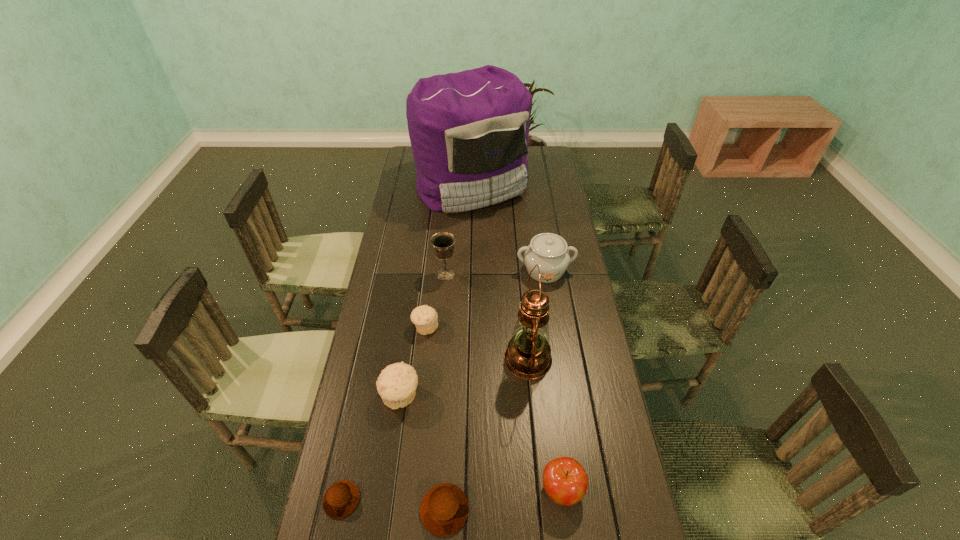
At what (x,y) coordinates should I click in order to perform the action: click on purple backpack. Please return your answer as a coordinate pair (x, y). Looking at the image, I should click on (469, 131).

Locate an element on the screen. backpack is located at coordinates (469, 131).

Identify the location of oil lamp. The image size is (960, 540). (528, 356).

At what (x,y) coordinates should I click in order to perform the action: click on chalice. Please return your answer as a coordinate pair (x, y). Looking at the image, I should click on (443, 242).

This screenshot has width=960, height=540. I want to click on white chinaware, so click(x=549, y=251).

Identify the location of the tallest muffin. Image resolution: width=960 pixels, height=540 pixels. (396, 384).

Identify the location of the second farthest muffin. This screenshot has width=960, height=540. (396, 384).

At what (x,y) coordinates should I click in order to perform the action: click on apple. Please return your answer as a coordinate pair (x, y). Looking at the image, I should click on (565, 481).

Find the location of a particular element. the third shortest object is located at coordinates (425, 318).

What are the coordinates of `the farther beige muffin` in the screenshot? It's located at (425, 318).